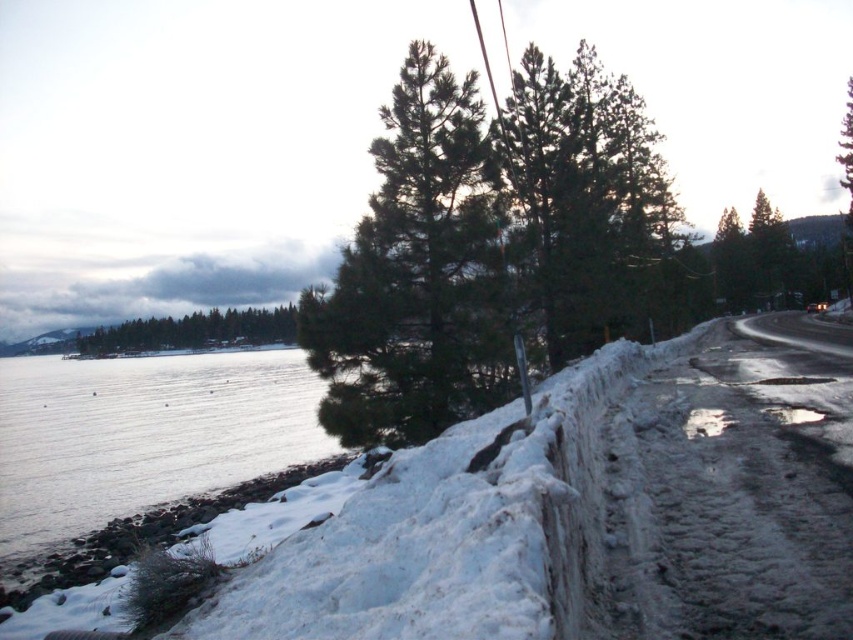
Question: Among these objects, which one is farthest from the camera?

Choices:
 (A) clear water at lower left
 (B) green matte trees at left

Answer: (B)

Question: In this image, where is clear water at lower left located relative to green matte trees at left?

Choices:
 (A) above
 (B) below

Answer: (B)

Question: Which point is farther from the camera taking this photo?

Choices:
 (A) (247, 448)
 (B) (395, 212)

Answer: (A)

Question: Does clear water at lower left have a larger size compared to green matte trees at left?

Choices:
 (A) yes
 (B) no

Answer: (A)

Question: Is green needle-like tree at center below green matte trees at left?

Choices:
 (A) yes
 (B) no

Answer: (B)

Question: Among these points, which one is nearest to the camera?

Choices:
 (A) (282, 314)
 (B) (123, 372)

Answer: (B)